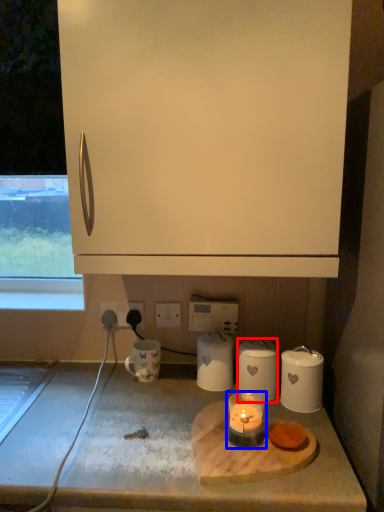
Question: Which of the following is the closest to the observer, kitchen appliance (highlighted by a red box) or candle holder (highlighted by a blue box)?

Choices:
 (A) kitchen appliance
 (B) candle holder

Answer: (B)